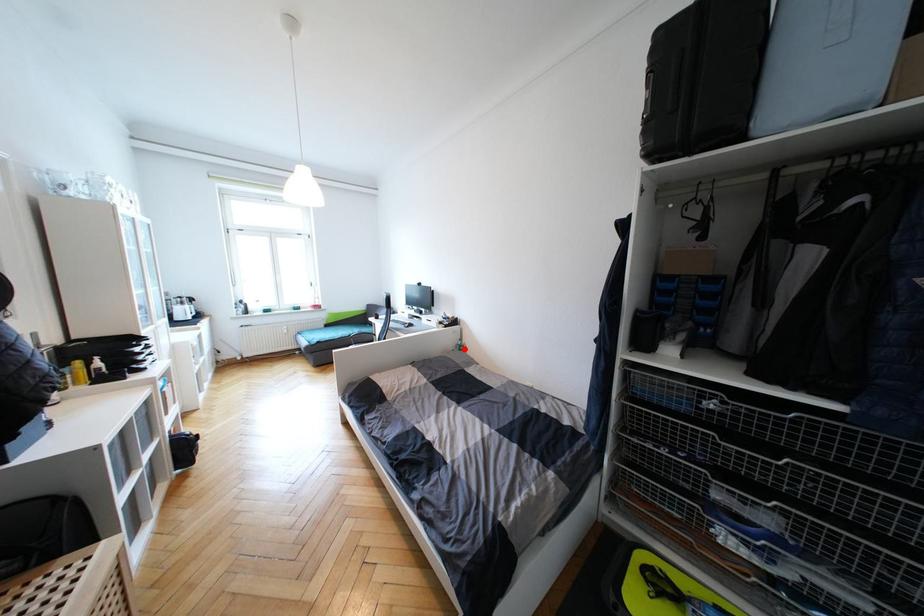
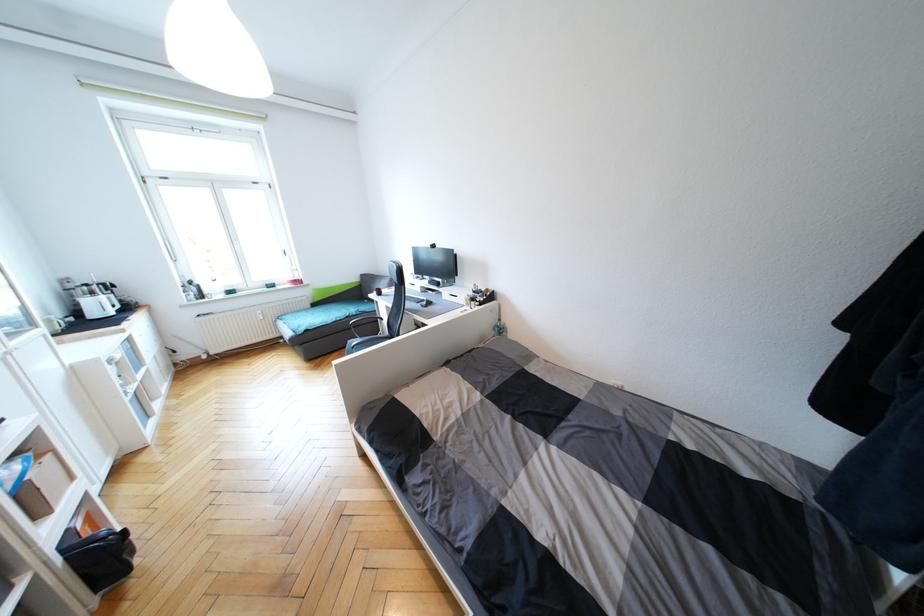
Locate, in the second image, the point that corresponds to the highlighted location in the first image.

(504, 331)